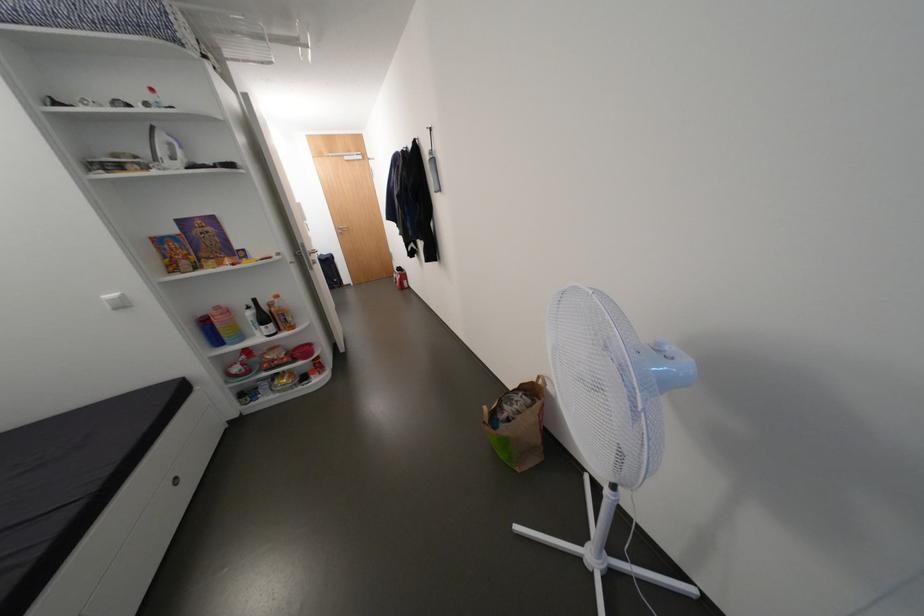
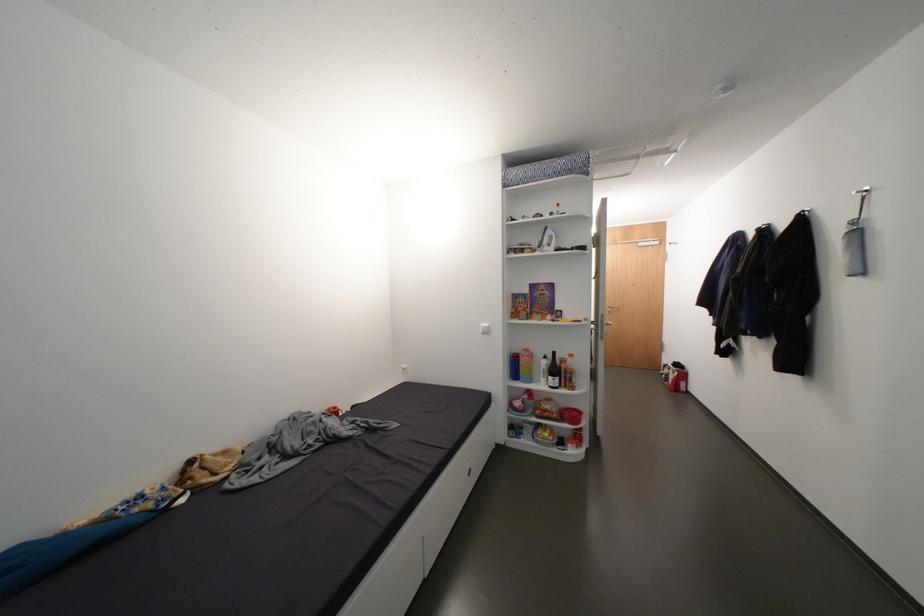
Locate, in the second image, the point that corresponds to (x=169, y=155) in the first image.

(553, 243)